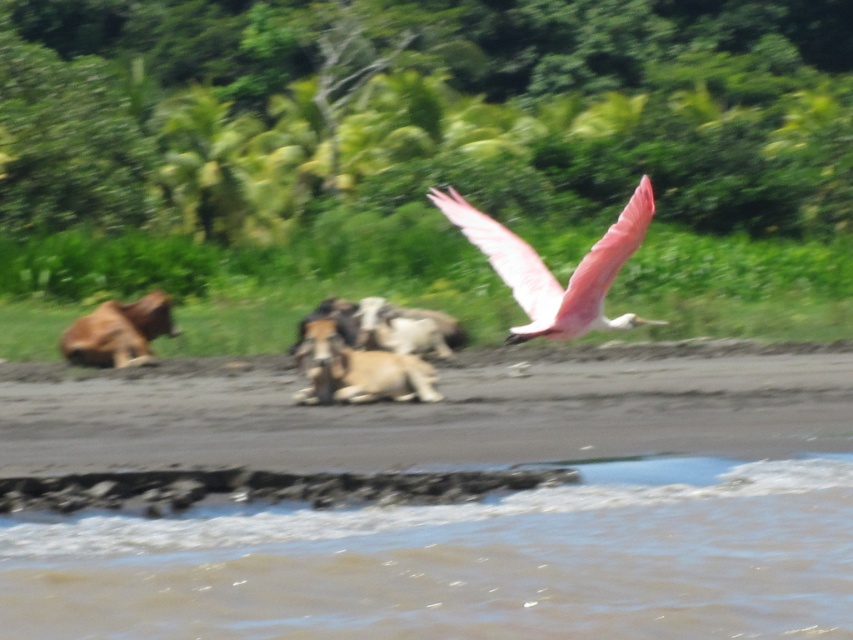
You are an animal photographer trying to capture both the pink feathered bird at upper right and the white woolen goat at center in a single frame. Based on their sizes in the image, which animal will appear smaller in the photo?

The pink feathered bird at upper right will appear smaller in the photo because it occupies less space than the white woolen goat at center.

You are a photographer standing in front of the brown fur dog at left and the white woolen goat at center. You want to take a photo that includes both animals. Which animal should you move closer to your camera to ensure both are in focus?

To ensure both the brown fur dog at left and the white woolen goat at center are in focus, you should move closer to the brown fur dog at left since it is closer to you than the white woolen goat at center. This adjustment will help balance their distances from the camera, improving the depth of field for both subjects.

You are standing at the origin point of the image. You see two points, point [370,385] and point [144,342]. Which point is closer to you?

Point [144,342] is closer to you because it is behind point [370,385].